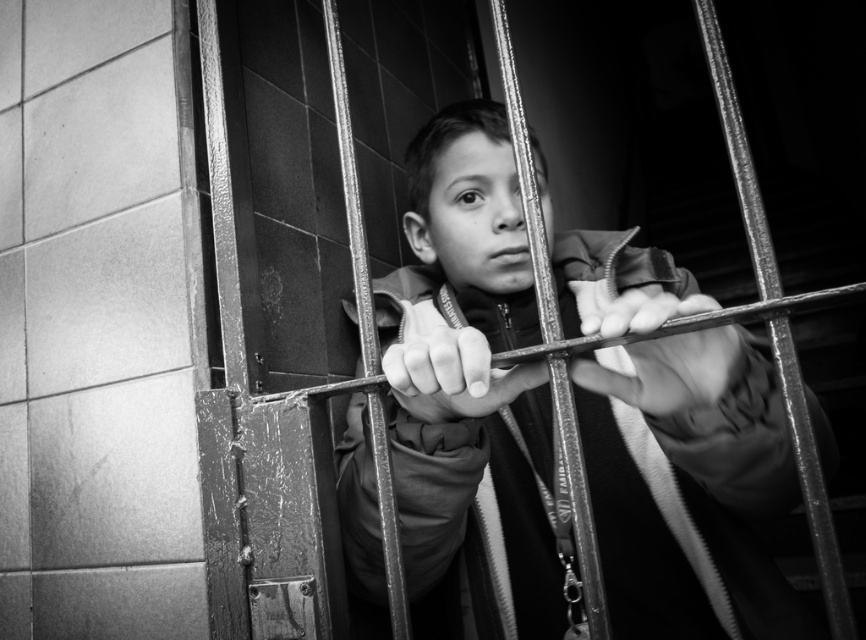
Question: Observing the image, what is the correct spatial positioning of matte black jacket at center in reference to smooth metal hand at center?

Choices:
 (A) below
 (B) above

Answer: (B)

Question: Can you confirm if matte black jacket at center is positioned to the right of smooth metal hand at center?

Choices:
 (A) no
 (B) yes

Answer: (A)

Question: Where is matte black jacket at center located in relation to smooth metal hand at center in the image?

Choices:
 (A) above
 (B) below

Answer: (A)

Question: Which point is closer to the camera taking this photo?

Choices:
 (A) (759, 404)
 (B) (724, 369)

Answer: (B)

Question: Which of the following is the farthest from the observer?

Choices:
 (A) matte black jacket at center
 (B) smooth metal hand at center

Answer: (A)